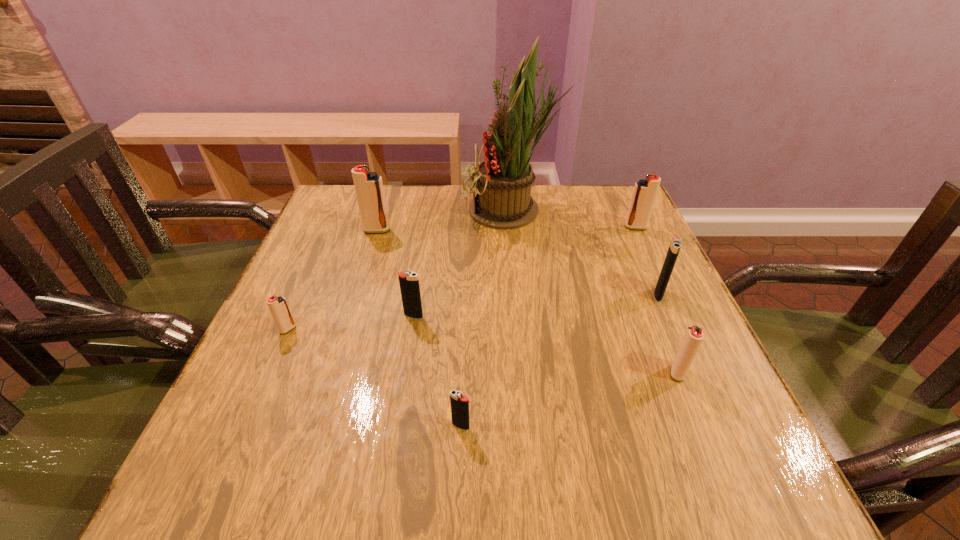
The height and width of the screenshot is (540, 960). In order to click on the third farthest red igniter in this screenshot , I will do `click(278, 306)`.

Where is `the leftmost red igniter`? This screenshot has height=540, width=960. the leftmost red igniter is located at coordinates (278, 306).

Identify the location of the nearest object. (459, 403).

Image resolution: width=960 pixels, height=540 pixels. Find the location of `the nearest igniter`. the nearest igniter is located at coordinates (459, 403).

Locate an element on the screen. The height and width of the screenshot is (540, 960). vacant space located 0.130m in front of the flower arrangement with the fan visible is located at coordinates coord(416,211).

You are a GUI agent. You are given a task and a screenshot of the screen. Output one action in this format:
    pyautogui.click(x=<x>, y=<y>)
    Task: Click on the vacant space located 0.270m in front of the flower arrangement with the fan visible
    The image size is (960, 540).
    Given the screenshot: What is the action you would take?
    [x=364, y=211]

The width and height of the screenshot is (960, 540). Find the location of `vacant region located 0.160m in front of the flower arrangement with the fan visible`. vacant region located 0.160m in front of the flower arrangement with the fan visible is located at coordinates (404, 211).

At what (x,y) coordinates should I click in order to perform the action: click on vacant region located 0.210m on the front of the sixth igniter from right to left. Please return your answer as a coordinate pair (x, y). Image resolution: width=960 pixels, height=540 pixels. Looking at the image, I should click on (358, 290).

The width and height of the screenshot is (960, 540). In order to click on free space located on the front of the second biggest red igniter in this screenshot , I will do `click(686, 336)`.

Find the location of a particular element. vacant space situated 0.230m on the left of the fifth nearest igniter is located at coordinates (546, 294).